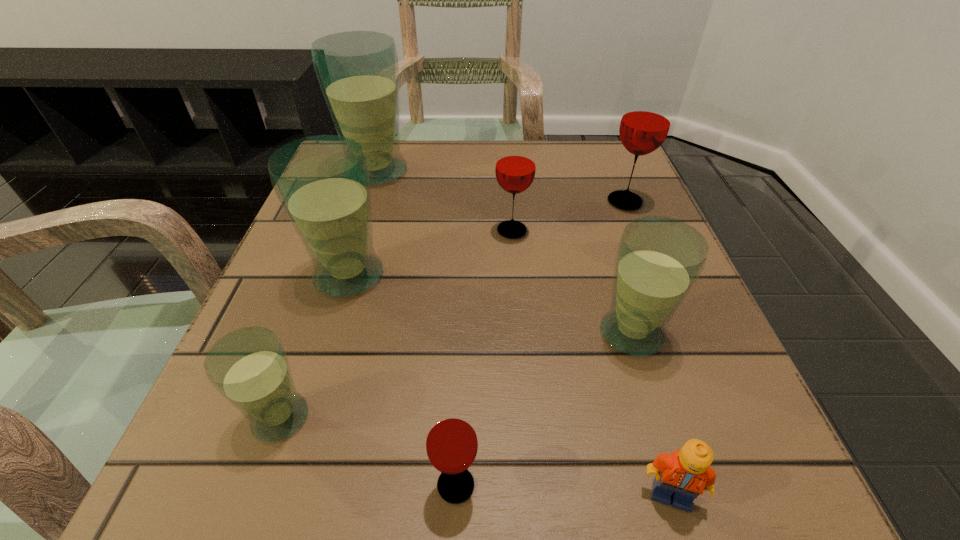
Identify the location of free space at the near edge of the desktop. (380, 457).

Image resolution: width=960 pixels, height=540 pixels. What are the coordinates of `free spot at the left edge of the desktop` in the screenshot? It's located at (303, 253).

In the image, there is a desktop. In order to click on vacant space at the right edge in this screenshot , I will do `click(664, 355)`.

In order to click on free location at the far right corner in this screenshot , I will do (584, 187).

Image resolution: width=960 pixels, height=540 pixels. In the image, there is a desktop. Identify the location of free region at the near right corner. (741, 448).

Where is `vacant space in between the tallest object and the nearest glass`? This screenshot has height=540, width=960. vacant space in between the tallest object and the nearest glass is located at coordinates (416, 328).

This screenshot has width=960, height=540. Find the location of `free space between the fifth nearest object and the biggest red glass`. free space between the fifth nearest object and the biggest red glass is located at coordinates (487, 239).

The width and height of the screenshot is (960, 540). Identify the location of vacant area between the fourth nearest glass and the second smallest blue glass. (491, 304).

Find the location of a particular element. The image size is (960, 540). free spot between the nearest blue glass and the rightmost blue glass is located at coordinates (456, 375).

Locate an element on the screen. vacant point located between the fourth farthest object and the third farthest blue glass is located at coordinates (491, 304).